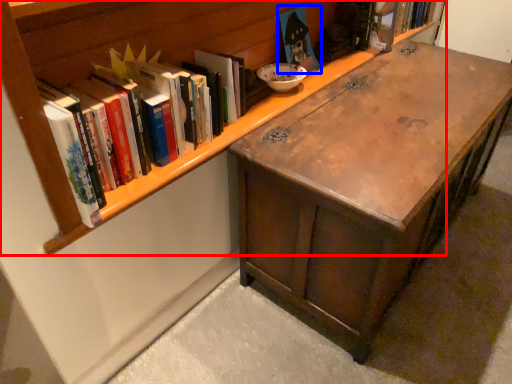
Question: Which object appears closest to the camera in this image, bookcase (highlighted by a red box) or book (highlighted by a blue box)?

Choices:
 (A) bookcase
 (B) book

Answer: (A)